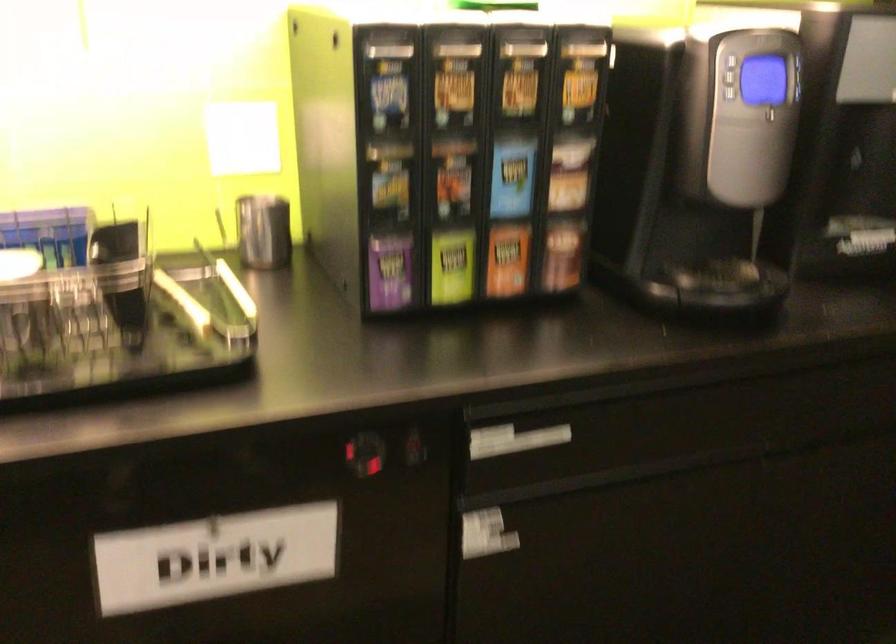
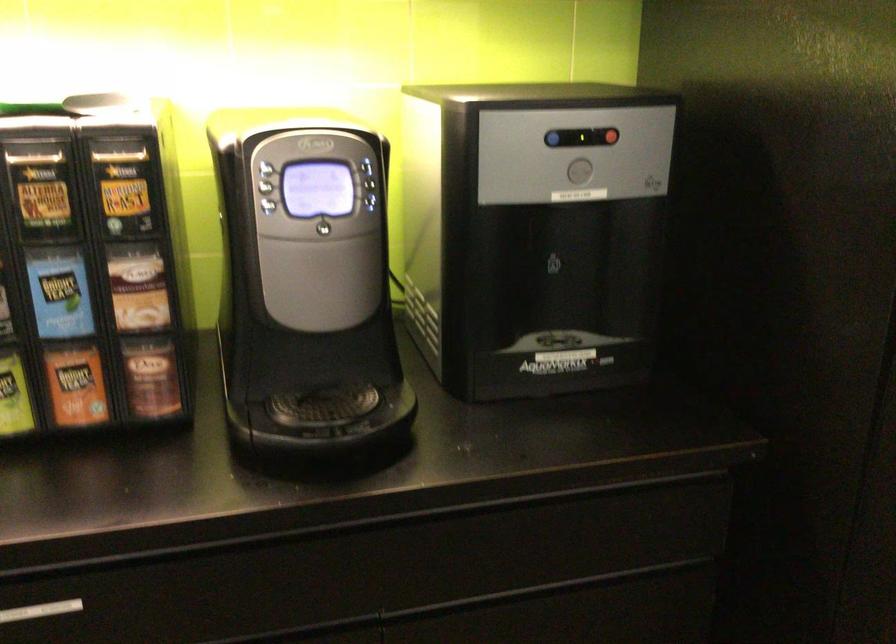
Where in the second image is the point corresponding to [583,76] from the first image?

(125, 185)